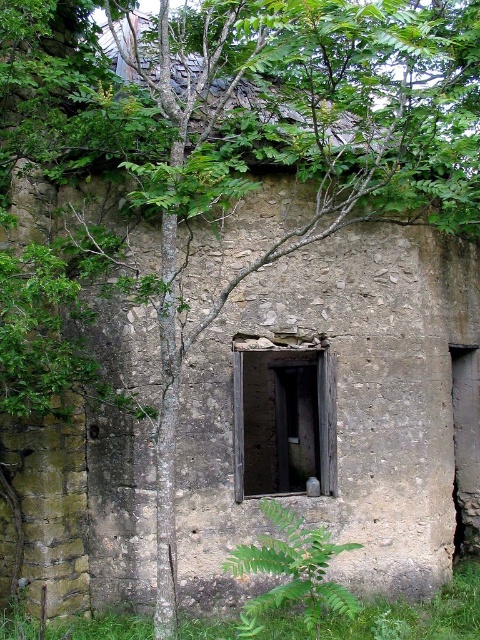
Question: Which object is farther from the camera taking this photo?

Choices:
 (A) dark wood door at center
 (B) green leafy fern at center

Answer: (A)

Question: Which object appears farthest from the camera in this image?

Choices:
 (A) dark wood door at center
 (B) green leafy fern at center

Answer: (A)

Question: Can you confirm if dark wood door at center is thinner than green leafy fern at center?

Choices:
 (A) yes
 (B) no

Answer: (A)

Question: Can you confirm if dark wood door at center is positioned to the right of green leafy fern at center?

Choices:
 (A) no
 (B) yes

Answer: (B)

Question: Does dark wood door at center have a larger size compared to green leafy fern at center?

Choices:
 (A) no
 (B) yes

Answer: (A)